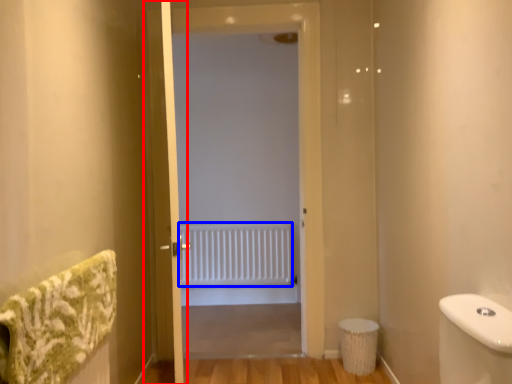
Question: Which point is closer to the camera, screen door (highlighted by a red box) or radiator (highlighted by a blue box)?

Choices:
 (A) screen door
 (B) radiator

Answer: (A)